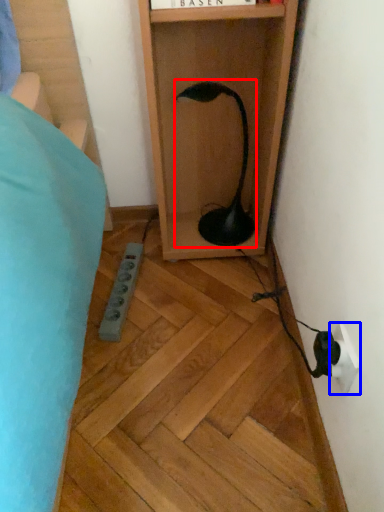
Question: Which object is closer to the camera taking this photo, lamp (highlighted by a red box) or electric outlet (highlighted by a blue box)?

Choices:
 (A) lamp
 (B) electric outlet

Answer: (B)